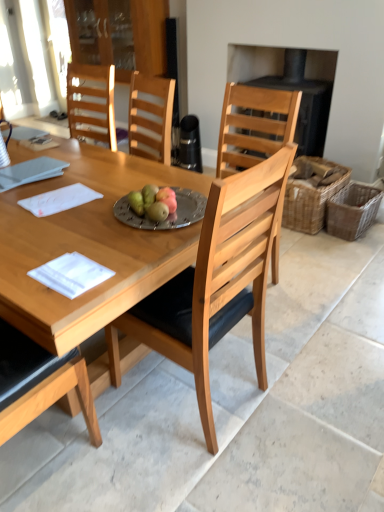
Question: In the image, is woven brown picnic basket at right, positioned as the 2th picnic basket in right-to-left order, positioned in front of or behind silver metallic plate at center?

Choices:
 (A) behind
 (B) front

Answer: (A)

Question: In terms of height, does woven brown picnic basket at right, which ranks as the first picnic basket in left-to-right order, look taller or shorter compared to silver metallic plate at center?

Choices:
 (A) short
 (B) tall

Answer: (B)

Question: Based on their relative distances, which object is farther from the woven brown picnic basket at right, the first picnic basket in the right-to-left sequence?

Choices:
 (A) light wood chair at center
 (B) silver metallic plate at center
 (C) white paper at left, positioned as the first notepad in back-to-front order
 (D) black matte fireplace at upper right
 (E) woven brown picnic basket at right, which ranks as the first picnic basket in left-to-right order

Answer: (C)

Question: Which object is the closest to the woven brown picnic basket at right, which ranks as the first picnic basket in left-to-right order?

Choices:
 (A) white paper at left, the 3th notepad in the bottom-to-top sequence
 (B) white paper at center, the 1th notepad when ordered from bottom to top
 (C) transparent glass cabinet at upper center
 (D) woven brown picnic basket at right, the first picnic basket in the right-to-left sequence
 (E) silver metallic plate at center

Answer: (D)